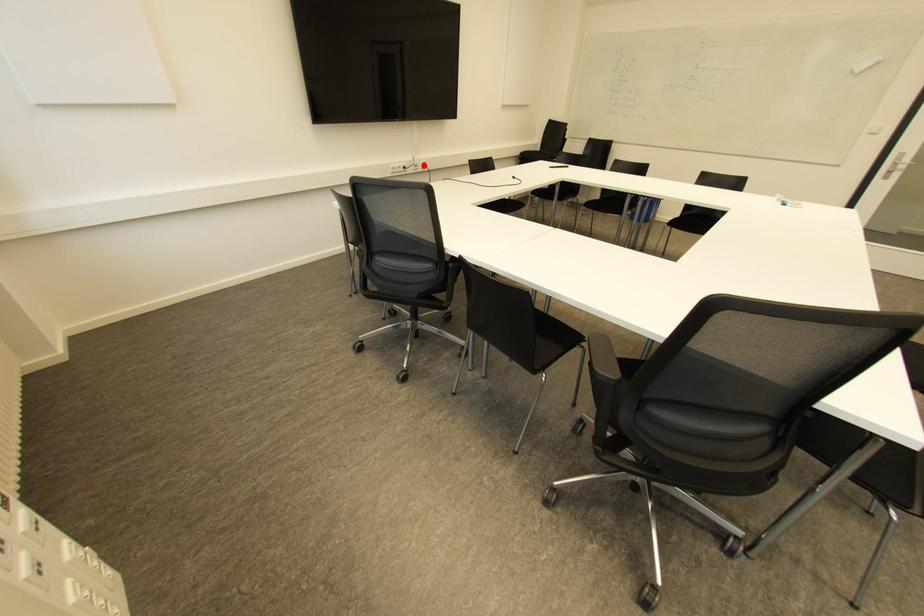
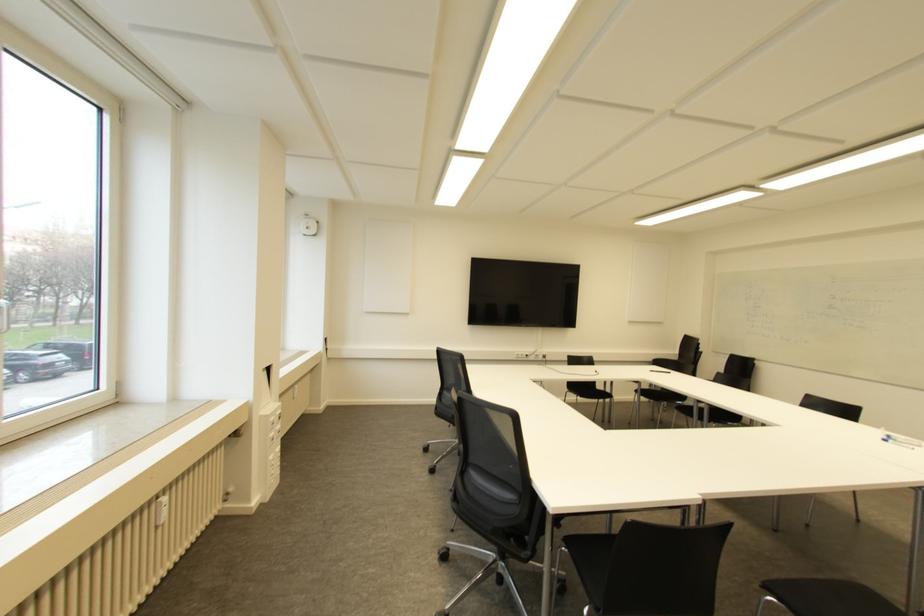
Question: I am providing you with two images of the same scene from different viewpoints. Image1 has a red point marked. In image2, the corresponding 3D location appears at what relative position? Reply with the corresponding letter.

Choices:
 (A) Closer
 (B) Farther

Answer: (A)